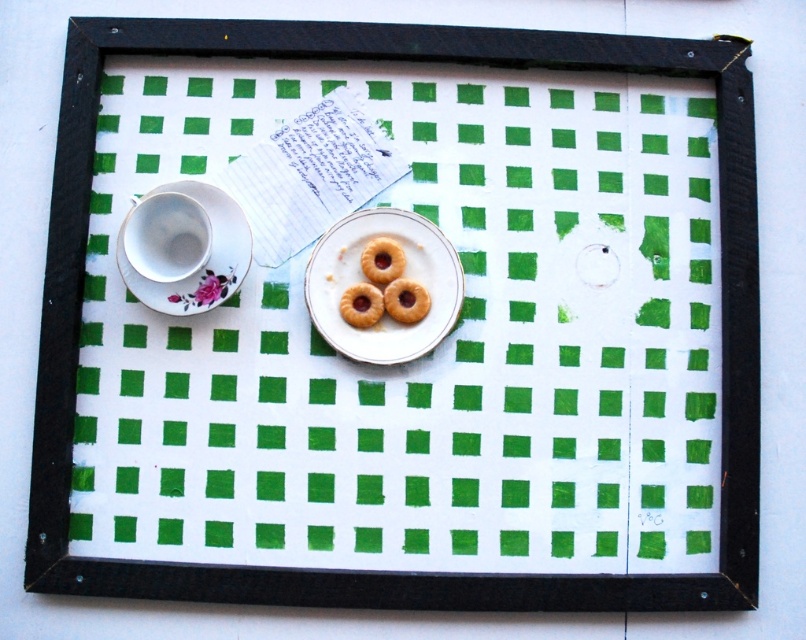
What is the 2D coordinate of the white porcelain saucer at center in the image?

The white porcelain saucer at center is located at the 2D coordinate point of (358, 276).

Please describe the position of the golden matte donut at center relative to the other objects in the scene.

The golden matte donut at center is located at the coordinates point (405,300), which is near the center of the scene.

You are looking at the framed arrangement on the green and white checkered surface. There are two points marked in the image, point 1 at coordinates point (412, 305) and point 2 at coordinates point (356, 292). Which point is closer to you?

Point (412, 305) is closer to the viewer than point (356, 292) because it is further to the viewer according to the description.